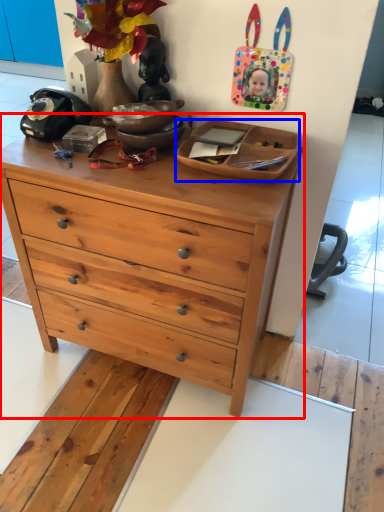
Question: Which object appears closest to the camera in this image, chest of drawers (highlighted by a red box) or cabinetry (highlighted by a blue box)?

Choices:
 (A) chest of drawers
 (B) cabinetry

Answer: (A)